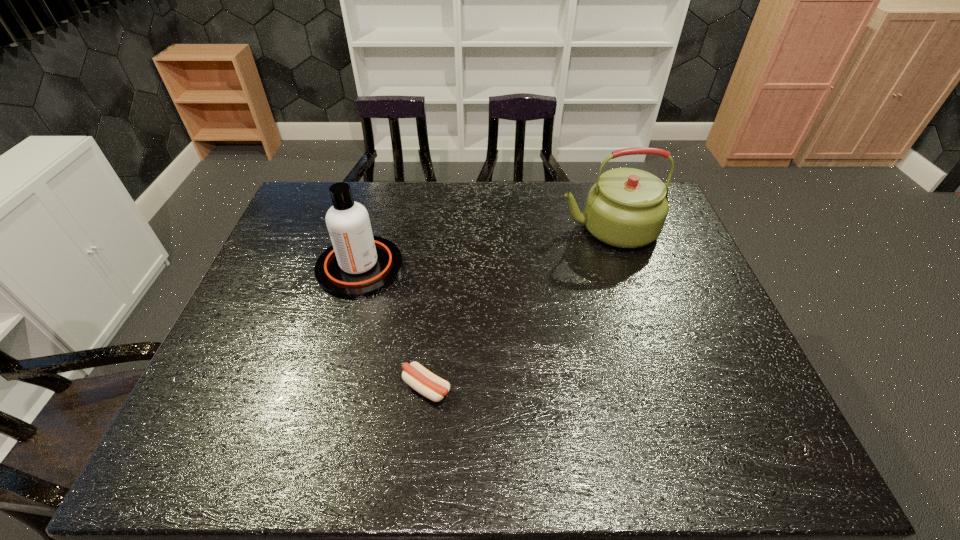
Find the location of a particular element. object at the left edge is located at coordinates (357, 264).

At what (x,y) coordinates should I click in order to perform the action: click on object located at the right edge. Please return your answer as a coordinate pair (x, y). Looking at the image, I should click on (626, 208).

I want to click on object present at the far right corner, so click(626, 208).

In order to click on vacant space at the far edge in this screenshot , I will do tap(439, 208).

Find the location of a particular element. This screenshot has width=960, height=540. vacant position at the near edge of the desktop is located at coordinates (532, 429).

What are the coordinates of `free space at the left edge of the desktop` in the screenshot? It's located at (270, 372).

Image resolution: width=960 pixels, height=540 pixels. I want to click on blank area at the right edge, so click(x=658, y=269).

This screenshot has height=540, width=960. In order to click on vacant area between the kettle and the cleansing agent in this screenshot , I will do `click(484, 247)`.

You are a GUI agent. You are given a task and a screenshot of the screen. Output one action in this format:
    pyautogui.click(x=<x>, y=<y>)
    Task: Click on the free point between the sausage and the leftmost object
    
    Given the screenshot: What is the action you would take?
    pyautogui.click(x=394, y=327)

The image size is (960, 540). Find the location of `blank region between the shortest object and the kettle`. blank region between the shortest object and the kettle is located at coordinates (517, 308).